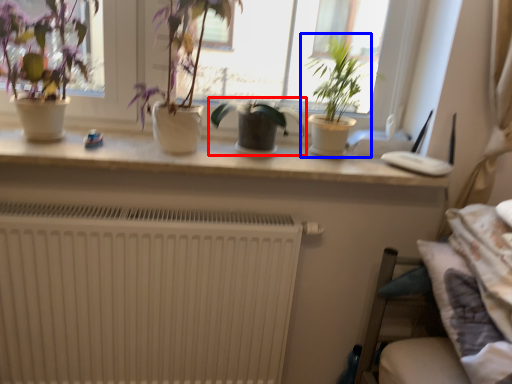
Question: Which object is further to the camera taking this photo, houseplant (highlighted by a red box) or houseplant (highlighted by a blue box)?

Choices:
 (A) houseplant
 (B) houseplant

Answer: (A)